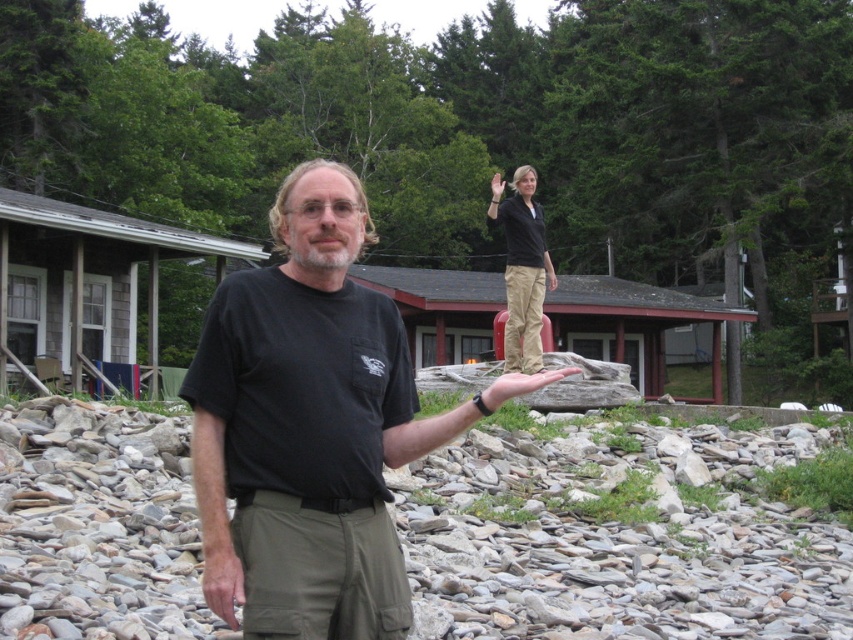
Question: In this image, where is gray smooth rocks at lower center located relative to black matte t-shirt at center?

Choices:
 (A) right
 (B) left

Answer: (A)

Question: Estimate the real-world distances between objects in this image. Which object is closer to the khaki pants at center?

Choices:
 (A) gray smooth rocks at lower center
 (B) black matte t-shirt at center

Answer: (A)

Question: Does gray smooth rocks at lower center appear on the right side of khaki pants at center?

Choices:
 (A) yes
 (B) no

Answer: (B)

Question: Which of the following is the closest to the observer?

Choices:
 (A) [x=666, y=554]
 (B) [x=386, y=422]

Answer: (B)

Question: Among these points, which one is farthest from the camera?

Choices:
 (A) (444, 493)
 (B) (239, 428)

Answer: (A)

Question: Is gray smooth rocks at lower center to the right of khaki pants at center from the viewer's perspective?

Choices:
 (A) no
 (B) yes

Answer: (A)